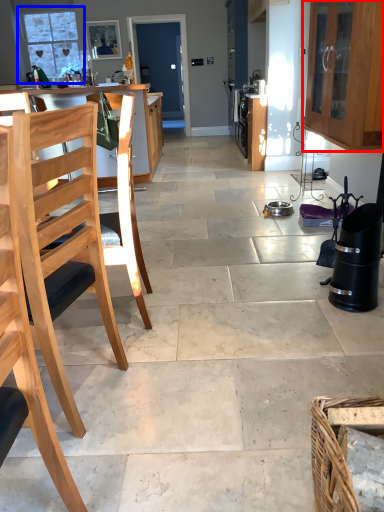
Question: Which object is closer to the camera taking this photo, cabinetry (highlighted by a red box) or window (highlighted by a blue box)?

Choices:
 (A) cabinetry
 (B) window

Answer: (A)